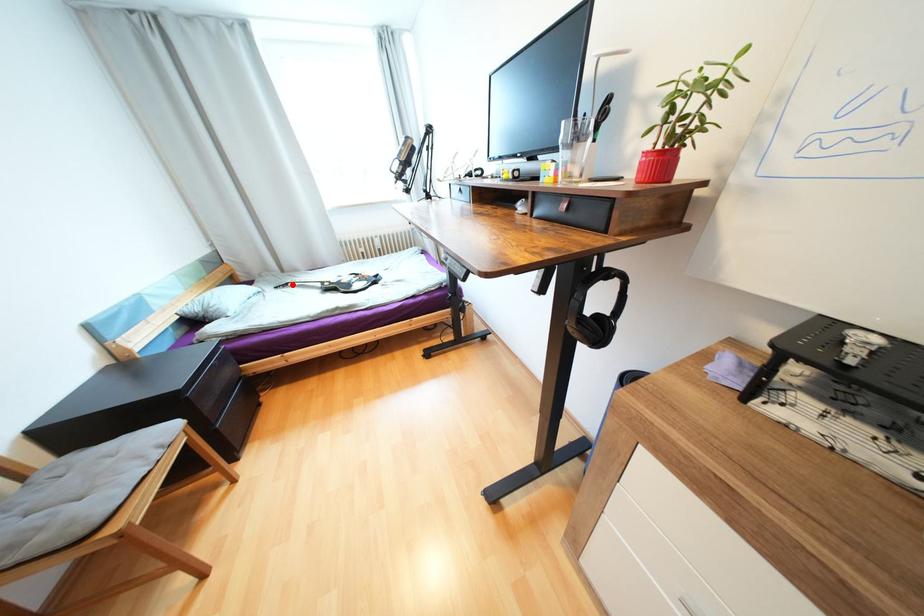
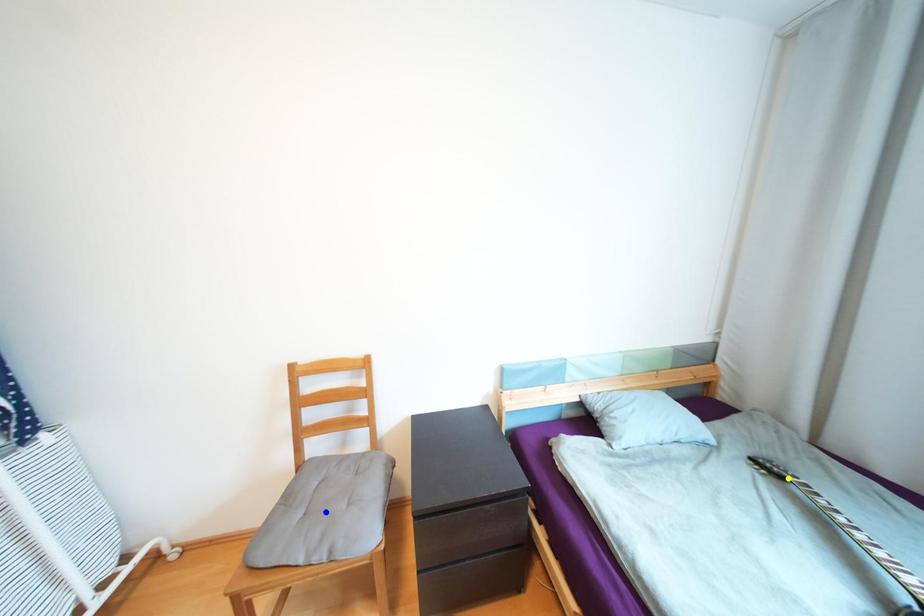
Question: I am providing you with two images of the same scene from different viewpoints. A red point is marked on the first image. You are given multiple points on the second image. Which point in image 2 is actually the same real-world point as the red point in image 1?

Choices:
 (A) green point
 (B) yellow point
 (C) blue point

Answer: (B)